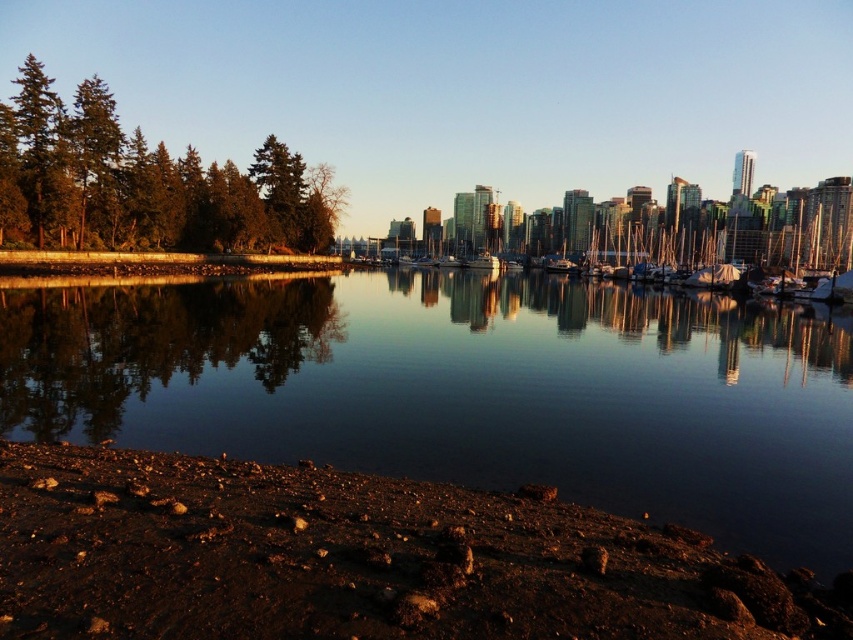
Does smooth reflective water at center have a greater height compared to white glossy boat at center?

Incorrect, smooth reflective water at center's height is not larger of white glossy boat at center's.

The height and width of the screenshot is (640, 853). What do you see at coordinates (466, 388) in the screenshot?
I see `smooth reflective water at center` at bounding box center [466, 388].

Which is in front, point (659, 518) or point (498, 266)?

Positioned in front is point (659, 518).

Locate an element on the screen. smooth reflective water at center is located at coordinates (466, 388).

Which is in front, point (648, 496) or point (30, 227)?

Point (648, 496)

Does smooth reflective water at center come behind green matte trees at left?

No, smooth reflective water at center is in front of green matte trees at left.

Which is in front, point (495, 305) or point (100, 93)?

Point (495, 305) is in front.

Find the location of a particular element. smooth reflective water at center is located at coordinates (466, 388).

Is dull brown dirt at lower left closer to camera compared to white glossy boat at center?

That is True.

What do you see at coordinates (355, 560) in the screenshot? This screenshot has height=640, width=853. I see `dull brown dirt at lower left` at bounding box center [355, 560].

What are the coordinates of `dull brown dirt at lower left` in the screenshot? It's located at (355, 560).